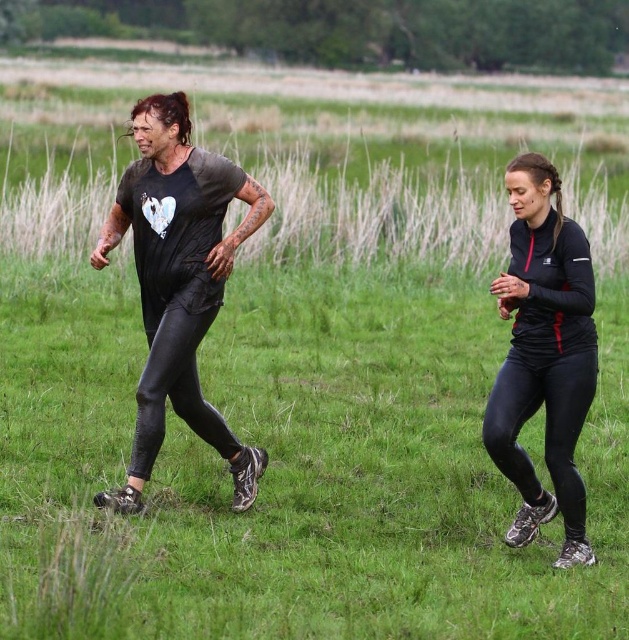
You are a photographer trying to capture the best shot of the scene. You notice a specific point in the image at coordinates (543, 355). What object is located at this point?

The point at coordinates (543, 355) corresponds to the matte black leggings at left.

You are a photographer trying to capture both runners in a single frame. Given that the matte black leggings at left and the black matte leggings at right are of different sizes, which runner should you focus on to ensure both are clearly visible in the photo?

To ensure both runners are clearly visible, focus on the matte black leggings at left since it is larger in size, allowing the photographer to frame the shot so both the larger and smaller leggings are in view.